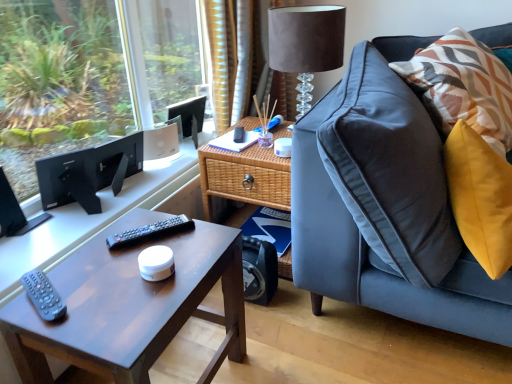
Question: From the image's perspective, is woven wood side table at center under black plastic remote at center, which appears as the 2th remote when viewed from the front?

Choices:
 (A) yes
 (B) no

Answer: (B)

Question: Is black plastic remote at center, positioned as the 1th remote in top-to-bottom order, at the back of woven wood side table at center?

Choices:
 (A) yes
 (B) no

Answer: (B)

Question: Does woven wood side table at center have a lesser height compared to black plastic remote at center, the second remote ordered from the bottom?

Choices:
 (A) no
 (B) yes

Answer: (A)

Question: Considering the relative sizes of woven wood side table at center and black plastic remote at center, which appears as the 1th remote when viewed from the right, in the image provided, is woven wood side table at center bigger than black plastic remote at center, which appears as the 1th remote when viewed from the right,?

Choices:
 (A) yes
 (B) no

Answer: (A)

Question: Could you tell me if woven wood side table at center is turned towards black plastic remote at center, positioned as the 1th remote in top-to-bottom order?

Choices:
 (A) yes
 (B) no

Answer: (A)

Question: Is black plastic remote at center, which appears as the 2th remote when viewed from the front, inside woven wood side table at center?

Choices:
 (A) no
 (B) yes

Answer: (A)

Question: Is woven wood side table at center located within black matte computer monitor at left?

Choices:
 (A) yes
 (B) no

Answer: (B)

Question: Does black matte computer monitor at left have a smaller size compared to woven wood side table at center?

Choices:
 (A) yes
 (B) no

Answer: (A)

Question: Does black matte computer monitor at left have a lesser width compared to woven wood side table at center?

Choices:
 (A) yes
 (B) no

Answer: (A)

Question: Can you confirm if black matte computer monitor at left is positioned to the right of woven wood side table at center?

Choices:
 (A) yes
 (B) no

Answer: (B)

Question: Is the surface of black matte computer monitor at left in direct contact with woven wood side table at center?

Choices:
 (A) yes
 (B) no

Answer: (B)

Question: From a real-world perspective, is black matte computer monitor at left located higher than woven wood side table at center?

Choices:
 (A) no
 (B) yes

Answer: (B)

Question: Is suede lampshade at upper right wider than matte brown coffee table at lower left?

Choices:
 (A) no
 (B) yes

Answer: (A)